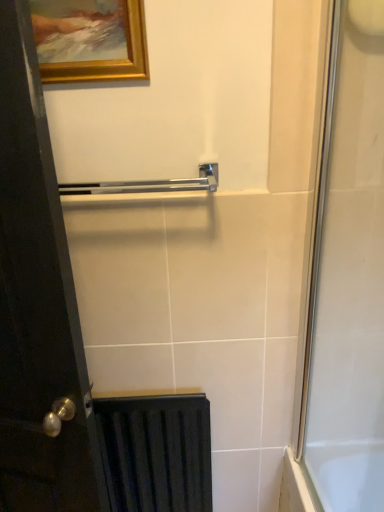
Question: Does clear glass shower door at right come behind black wood door at left?

Choices:
 (A) no
 (B) yes

Answer: (A)

Question: Is clear glass shower door at right turned away from black wood door at left?

Choices:
 (A) no
 (B) yes

Answer: (B)

Question: Does clear glass shower door at right have a lesser height compared to black wood door at left?

Choices:
 (A) yes
 (B) no

Answer: (A)

Question: Is the position of clear glass shower door at right less distant than that of black wood door at left?

Choices:
 (A) yes
 (B) no

Answer: (A)

Question: Can you confirm if clear glass shower door at right is smaller than black wood door at left?

Choices:
 (A) yes
 (B) no

Answer: (A)

Question: From the image's perspective, relative to polished chrome towel bar at center, is gold wooden picture frame at upper left above or below?

Choices:
 (A) above
 (B) below

Answer: (A)

Question: Is point (66, 27) closer or farther from the camera than point (115, 189)?

Choices:
 (A) farther
 (B) closer

Answer: (B)

Question: Looking at the image, does gold wooden picture frame at upper left seem bigger or smaller compared to polished chrome towel bar at center?

Choices:
 (A) big
 (B) small

Answer: (B)

Question: Considering the relative positions of gold wooden picture frame at upper left and polished chrome towel bar at center in the image provided, is gold wooden picture frame at upper left to the left or to the right of polished chrome towel bar at center?

Choices:
 (A) left
 (B) right

Answer: (A)

Question: Considering the positions of matte black radiator at lower left and black wood door at left in the image, is matte black radiator at lower left wider or thinner than black wood door at left?

Choices:
 (A) thin
 (B) wide

Answer: (A)

Question: Looking at the image, does matte black radiator at lower left seem bigger or smaller compared to black wood door at left?

Choices:
 (A) big
 (B) small

Answer: (B)

Question: From the image's perspective, is matte black radiator at lower left located above or below black wood door at left?

Choices:
 (A) above
 (B) below

Answer: (B)

Question: Is matte black radiator at lower left spatially inside black wood door at left, or outside of it?

Choices:
 (A) inside
 (B) outside

Answer: (B)

Question: In the image, is clear glass shower door at right on the left side or the right side of matte black radiator at lower left?

Choices:
 (A) left
 (B) right

Answer: (B)

Question: From the image's perspective, relative to matte black radiator at lower left, is clear glass shower door at right above or below?

Choices:
 (A) above
 (B) below

Answer: (A)